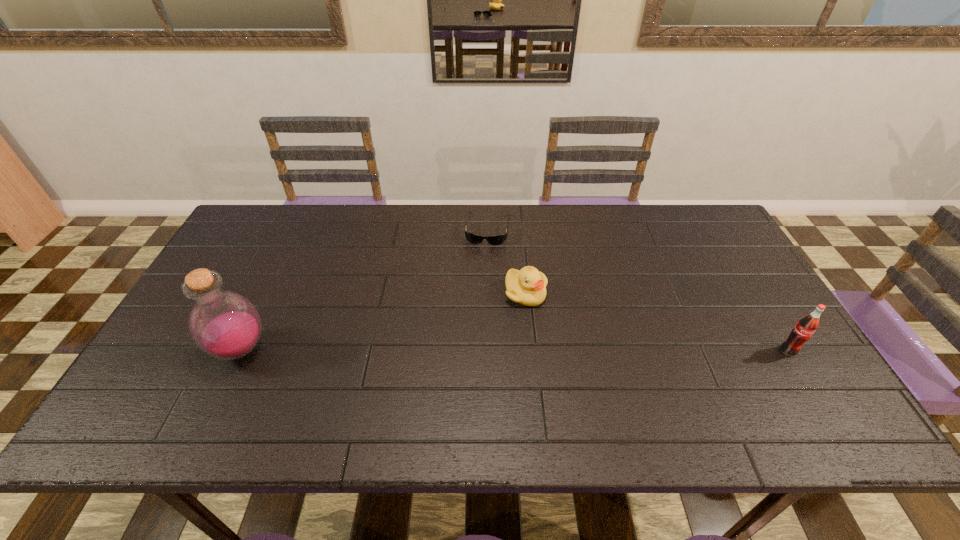
The height and width of the screenshot is (540, 960). I want to click on free space between the tallest object and the rightmost object, so click(515, 350).

This screenshot has height=540, width=960. I want to click on vacant space in between the leftmost object and the soda bottle, so click(x=515, y=350).

The height and width of the screenshot is (540, 960). Identify the location of vacant area that lies between the shortest object and the bottle. (365, 289).

Locate an element on the screen. free space between the duckling and the sunglasses is located at coordinates (507, 261).

This screenshot has height=540, width=960. I want to click on empty space that is in between the second farthest object and the soda bottle, so click(x=657, y=322).

I want to click on vacant region between the third nearest object and the tallest object, so click(383, 321).

Where is `free space that is in between the farthest object and the tallest object`? free space that is in between the farthest object and the tallest object is located at coordinates (365, 289).

The width and height of the screenshot is (960, 540). Find the location of `unoccupied position between the leftmost object and the shortest object`. unoccupied position between the leftmost object and the shortest object is located at coordinates (365, 289).

The image size is (960, 540). Identify the location of object that stands as the third closest to the bottle. (807, 325).

At what (x,y) coordinates should I click in order to perform the action: click on object that is the second closest to the third tallest object. Please return your answer as a coordinate pair (x, y). Looking at the image, I should click on (807, 325).